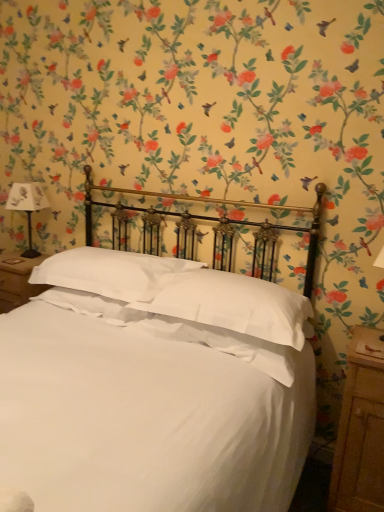
Question: From a real-world perspective, is white soft pillow at center, positioned as the second pillow in right-to-left order, on top of white paper lampshade at left?

Choices:
 (A) yes
 (B) no

Answer: (B)

Question: Is white soft pillow at center, positioned as the second pillow in right-to-left order, not inside white paper lampshade at left?

Choices:
 (A) yes
 (B) no

Answer: (A)

Question: Is white soft pillow at center, positioned as the second pillow in right-to-left order, closer to camera compared to white paper lampshade at left?

Choices:
 (A) yes
 (B) no

Answer: (A)

Question: Is white soft pillow at center, positioned as the second pillow in right-to-left order, shorter than white paper lampshade at left?

Choices:
 (A) yes
 (B) no

Answer: (A)

Question: From the image's perspective, is white soft pillow at center, positioned as the second pillow in right-to-left order, on top of white paper lampshade at left?

Choices:
 (A) yes
 (B) no

Answer: (B)

Question: Considering the relative sizes of white soft pillow at center, which ranks as the first pillow in left-to-right order, and white paper lampshade at left in the image provided, is white soft pillow at center, which ranks as the first pillow in left-to-right order, wider than white paper lampshade at left?

Choices:
 (A) no
 (B) yes

Answer: (B)

Question: Is white soft pillow at center, which ranks as the 1th pillow in right-to-left order, in front of white satin bed at center?

Choices:
 (A) no
 (B) yes

Answer: (A)

Question: From the image's perspective, is white soft pillow at center, which is counted as the 2th pillow, starting from the left, on white satin bed at center?

Choices:
 (A) yes
 (B) no

Answer: (A)

Question: From a real-world perspective, is white soft pillow at center, which is counted as the 2th pillow, starting from the left, physically above white satin bed at center?

Choices:
 (A) no
 (B) yes

Answer: (B)

Question: Is white soft pillow at center, which is counted as the 2th pillow, starting from the left, aimed at white satin bed at center?

Choices:
 (A) yes
 (B) no

Answer: (A)

Question: Is white soft pillow at center, which is counted as the 2th pillow, starting from the left, positioned behind white satin bed at center?

Choices:
 (A) no
 (B) yes

Answer: (B)

Question: Is white soft pillow at center, which is counted as the 2th pillow, starting from the left, wider than white satin bed at center?

Choices:
 (A) yes
 (B) no

Answer: (B)

Question: Does wooden nightstand at right turn towards white satin bed at center?

Choices:
 (A) no
 (B) yes

Answer: (A)